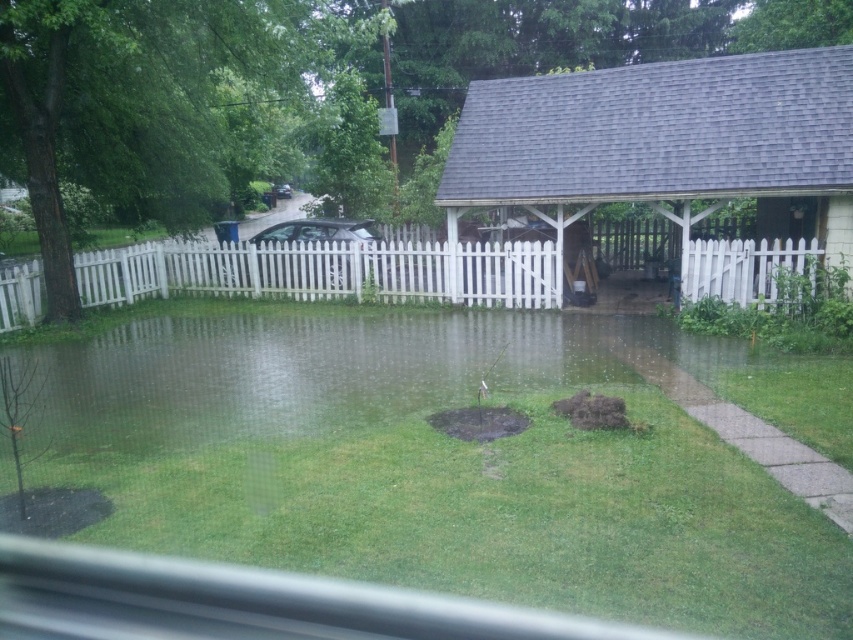
Question: Is gray shingled gazebo at right closer to camera compared to silver metallic car at center?

Choices:
 (A) yes
 (B) no

Answer: (A)

Question: In this image, where is gray shingled gazebo at right located relative to glossy black car at center?

Choices:
 (A) above
 (B) below

Answer: (B)

Question: Which object is closer to the camera taking this photo?

Choices:
 (A) glossy black car at center
 (B) silver metallic car at center
 (C) transparent water at center

Answer: (C)

Question: Is silver metallic car at center thinner than glossy black car at center?

Choices:
 (A) yes
 (B) no

Answer: (B)

Question: Among these points, which one is farthest from the camera?

Choices:
 (A) (346, 220)
 (B) (498, 125)

Answer: (A)

Question: Which point is closer to the camera taking this photo?

Choices:
 (A) (280, 196)
 (B) (312, 234)

Answer: (B)